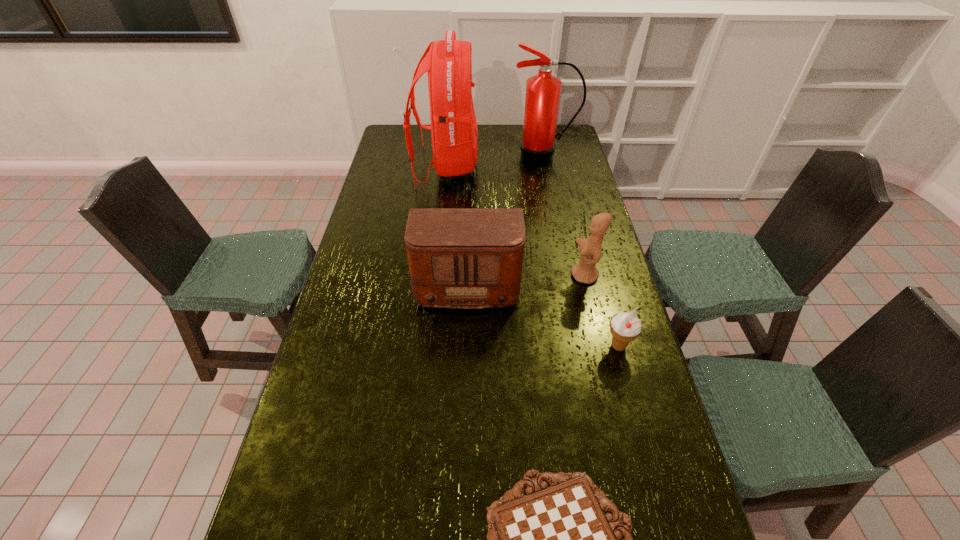
I want to click on vacant area situated on the front-facing side of the figurine, so click(548, 276).

This screenshot has width=960, height=540. In order to click on vacant space located 0.180m on the front-facing side of the figurine in this screenshot , I will do `click(518, 276)`.

Find the location of `blank space located 0.380m on the left of the icecream`. blank space located 0.380m on the left of the icecream is located at coordinates (473, 346).

Identify the location of backpack situated at the far edge. The width and height of the screenshot is (960, 540). (454, 132).

Find the location of a particular element. fire extinguisher that is at the far edge is located at coordinates (537, 146).

Identify the location of fire extinguisher at the right edge. pos(537,146).

This screenshot has width=960, height=540. Identify the location of figurine that is at the right edge. (590, 249).

Locate an element on the screen. icecream present at the right edge is located at coordinates (625, 327).

Image resolution: width=960 pixels, height=540 pixels. In order to click on object present at the far right corner in this screenshot , I will do `click(537, 146)`.

This screenshot has width=960, height=540. Identify the location of free space at the far edge. (x=430, y=124).